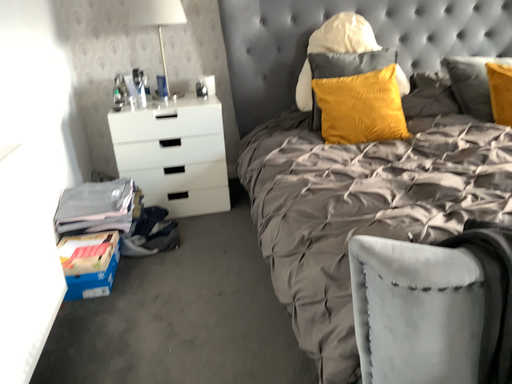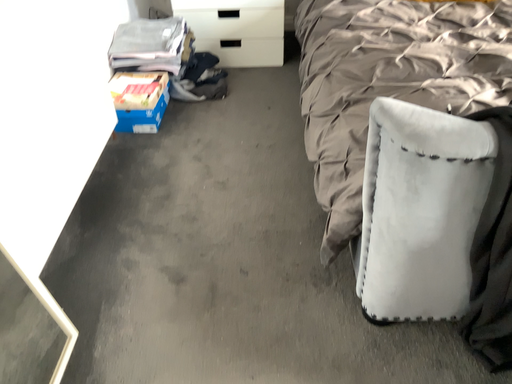
Question: Which way did the camera rotate in the video?

Choices:
 (A) rotated right
 (B) rotated left

Answer: (B)